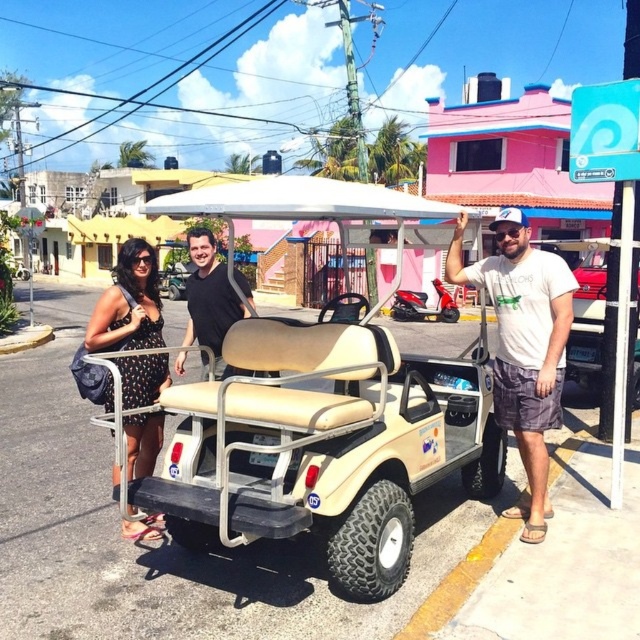
From the picture: Please look at the point marked at coordinates (324, 442). What object is located at that point?

The point at coordinates (324, 442) indicates the beige fabric golf cart at center.